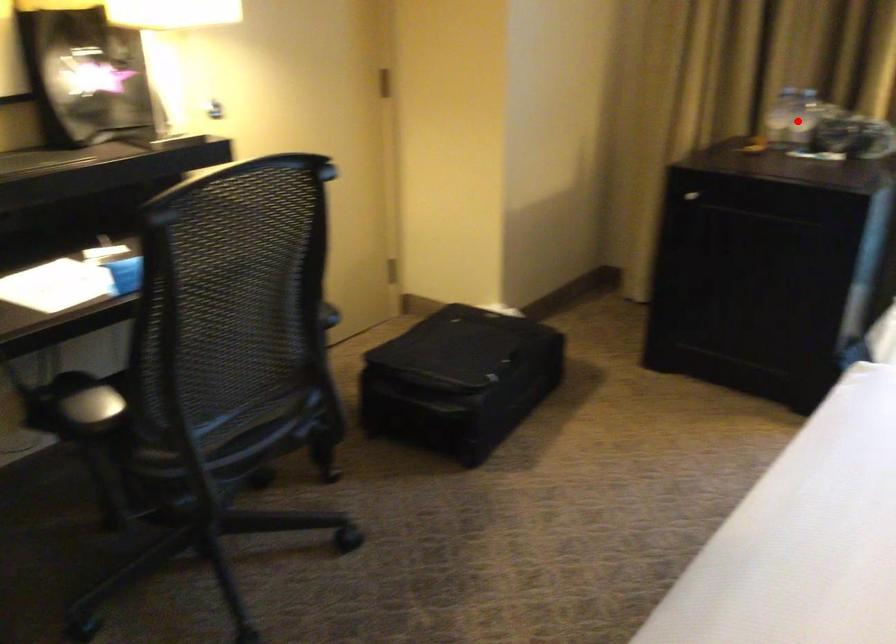
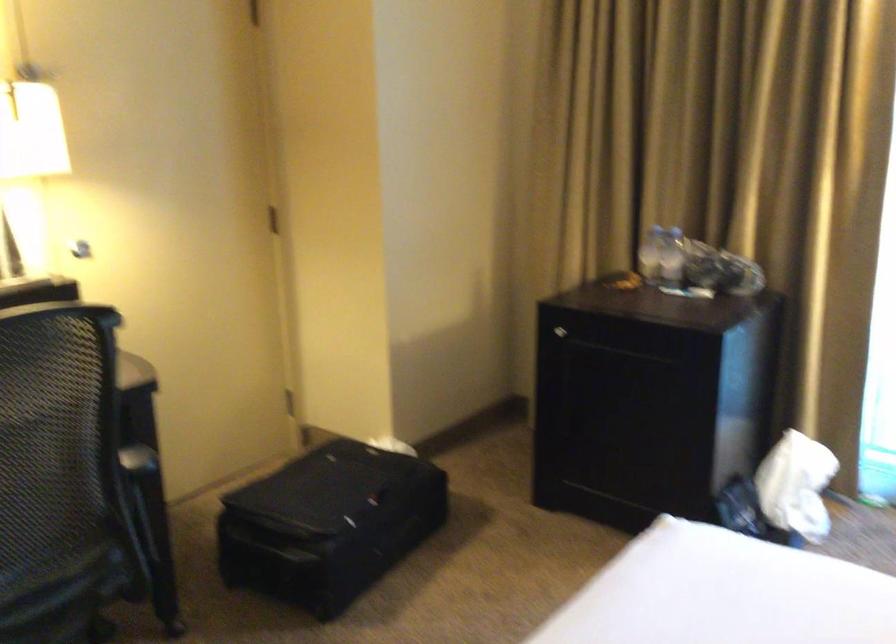
Find the pixel in the second image that matches the highlighted location in the first image.

(670, 257)